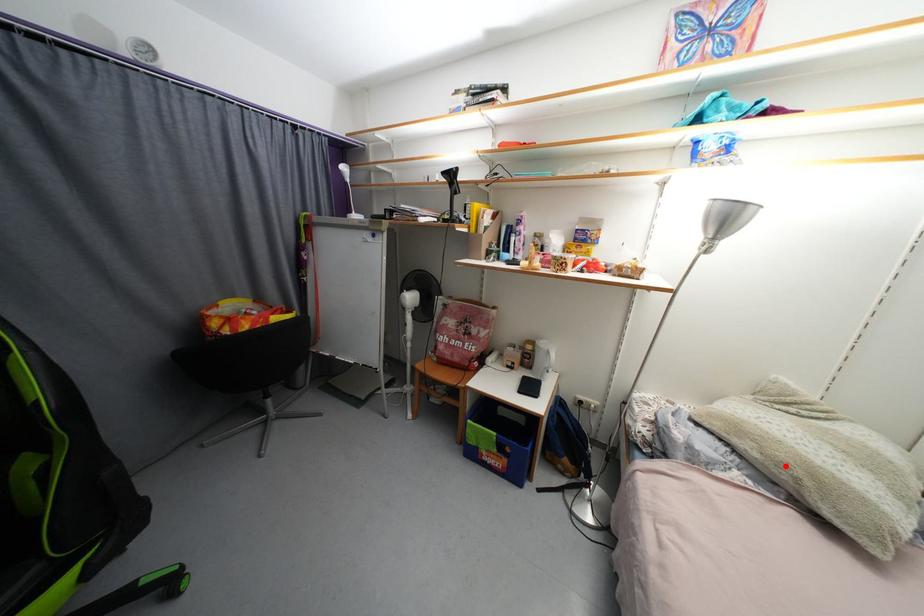
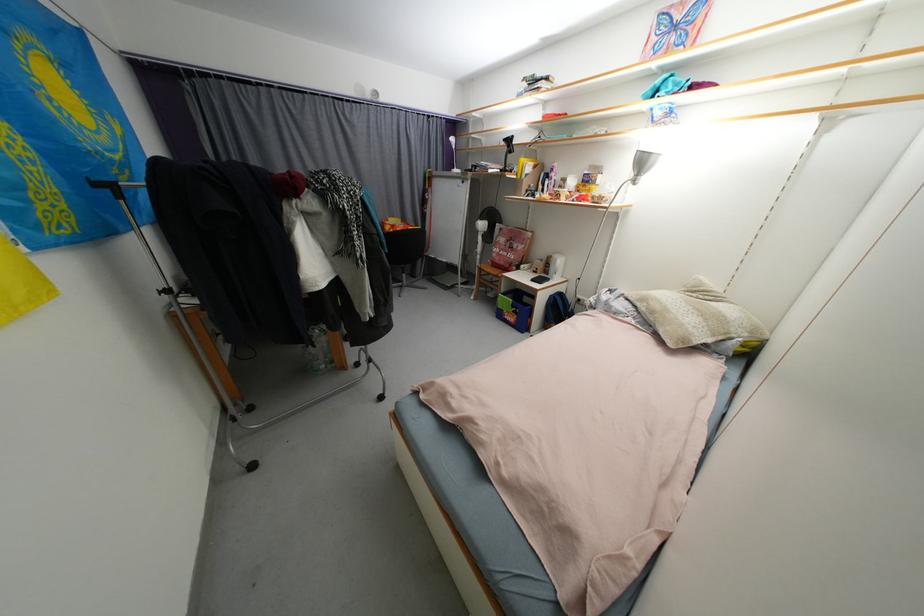
Question: I am providing you with two images of the same scene from different viewpoints. In image1, a red point is highlighted. Considering the same 3D point in image2, which of the following is correct?

Choices:
 (A) It is closer
 (B) It is farther

Answer: (A)